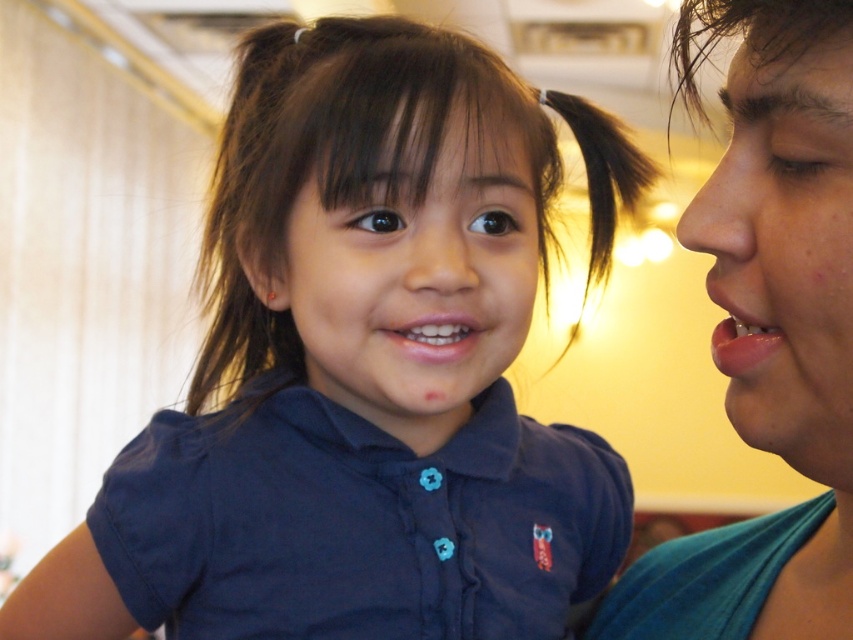
Looking at this image, based on the scene description, can you determine which object is closer to the observer between the smooth skin face at right and the dark brown silky hair at upper right?

The smooth skin face at right is closer to the observer because it is in front of the dark brown silky hair at upper right.

You are a photographer trying to capture the perfect shot of the smooth skin face at right and the dark brown silky hair at upper right. Based on their positions, which object is closer to the top of the frame?

The dark brown silky hair at upper right is closer to the top of the frame because it is positioned above the smooth skin face at right.

You are a photographer adjusting your camera settings to focus on the matte teal shirt at right and the pink glossy lips at right. Which object should you focus on first to ensure both are in clear view?

The matte teal shirt at right is closer to the viewer than the pink glossy lips at right, so focus on the matte teal shirt at right first to ensure both are in clear view.